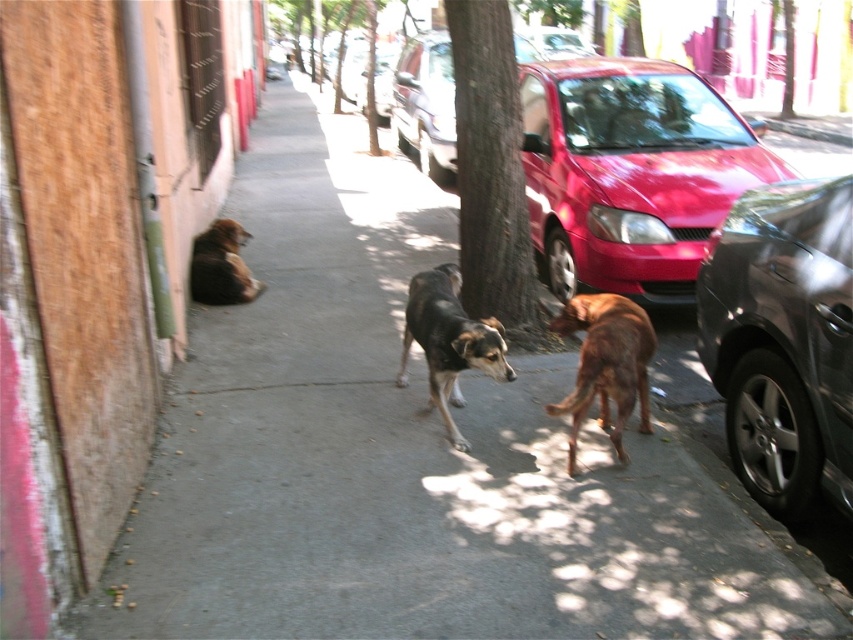
Between shiny metallic car at right and shiny red car at center, which one appears on the right side from the viewer's perspective?

Positioned to the right is shiny metallic car at right.

Which is above, shiny metallic car at right or shiny red car at center?

shiny red car at center is above.

What do you see at coordinates (782, 340) in the screenshot? I see `shiny metallic car at right` at bounding box center [782, 340].

This screenshot has width=853, height=640. Find the location of `shiny metallic car at right`. shiny metallic car at right is located at coordinates (782, 340).

Between shiny red car at right and green textured tree at center, which one has less height?

With less height is green textured tree at center.

Image resolution: width=853 pixels, height=640 pixels. Describe the element at coordinates (631, 172) in the screenshot. I see `shiny red car at right` at that location.

Does point (564, 168) lie in front of point (517, 232)?

No, (564, 168) is further to viewer.

Find the location of a particular element. Image resolution: width=853 pixels, height=640 pixels. shiny red car at right is located at coordinates (631, 172).

Can you confirm if brown furry dog at center is bigger than shiny red car at center?

Incorrect, brown furry dog at center is not larger than shiny red car at center.

Does brown furry dog at center appear over shiny red car at center?

No, brown furry dog at center is not above shiny red car at center.

Between point (573, 396) and point (418, 150), which one is positioned in front?

Point (573, 396) is more forward.

Locate an element on the screen. brown furry dog at center is located at coordinates (606, 364).